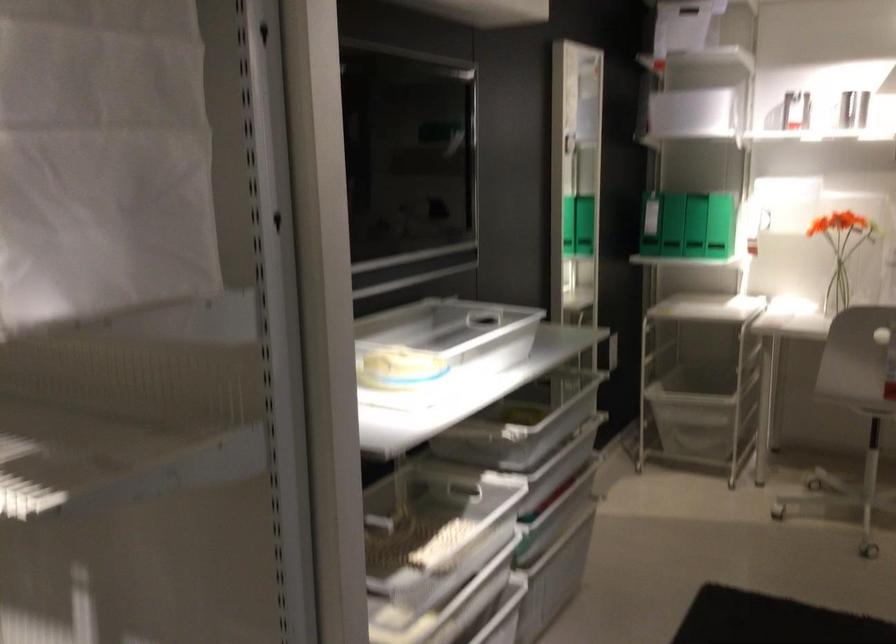
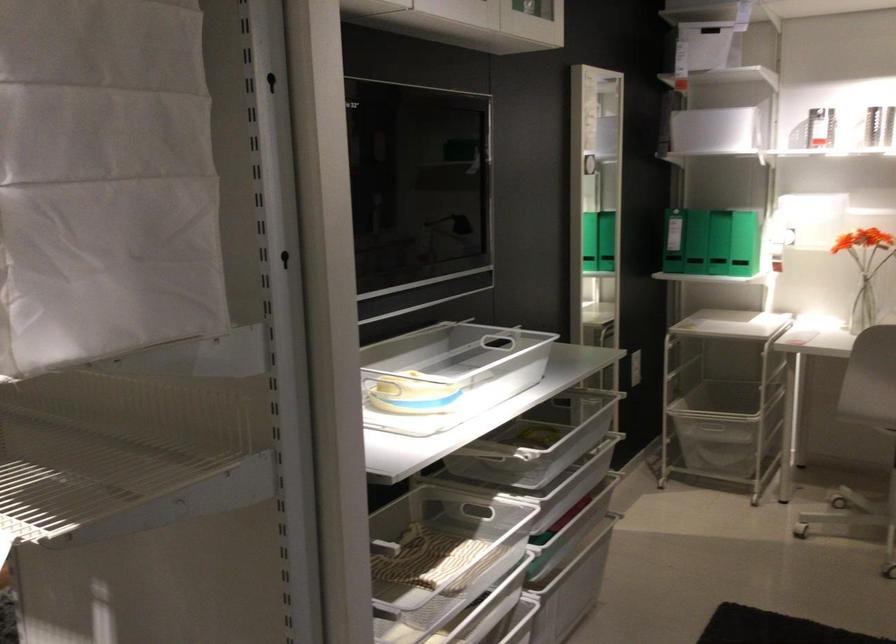
The point at (552, 406) is marked in the first image. Where is the corresponding point in the second image?

(561, 428)